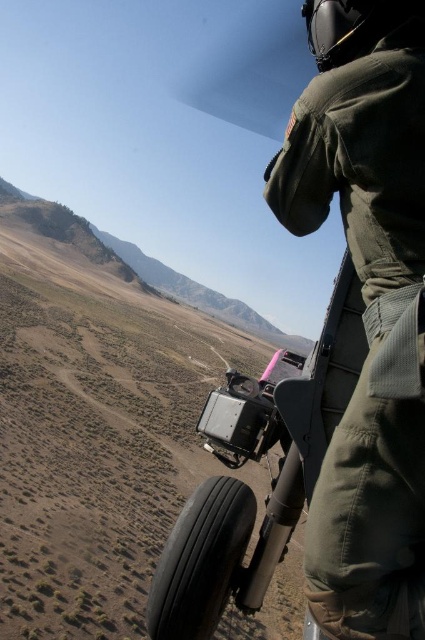
Question: Does green fabric uniform at upper right appear on the right side of black rubber tire at lower center?

Choices:
 (A) no
 (B) yes

Answer: (B)

Question: In this image, where is green fabric uniform at upper right located relative to black rubber tire at lower center?

Choices:
 (A) right
 (B) left

Answer: (A)

Question: Which of the following is the closest to the observer?

Choices:
 (A) green fabric uniform at upper right
 (B) black rubber tire at lower center

Answer: (A)

Question: Is green fabric uniform at upper right in front of black rubber tire at lower center?

Choices:
 (A) no
 (B) yes

Answer: (B)